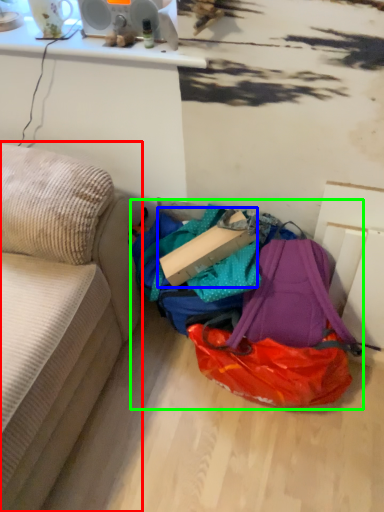
Question: Estimate the real-world distances between objects in this image. Which object is farther from studio couch (highlighted by a red box), cardboard box (highlighted by a blue box) or bag (highlighted by a green box)?

Choices:
 (A) cardboard box
 (B) bag

Answer: (B)